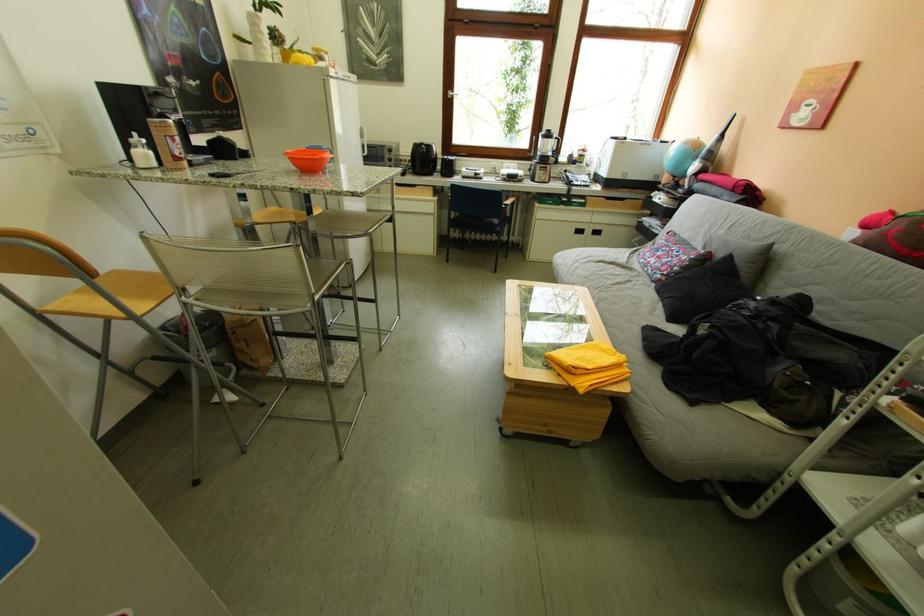
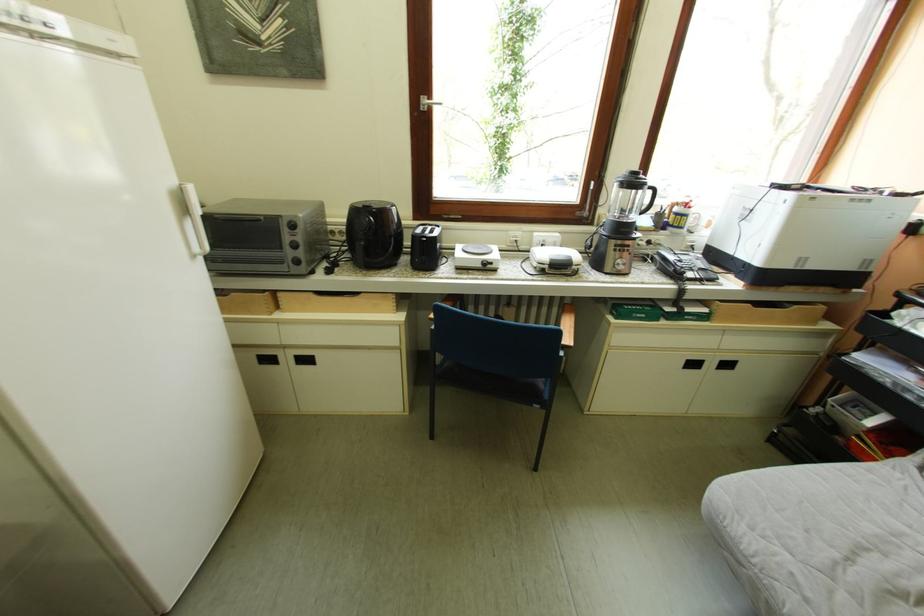
Question: What movement of the cameraman would produce the second image?

Choices:
 (A) Left
 (B) Right
 (C) Forward
 (D) Backward

Answer: (C)